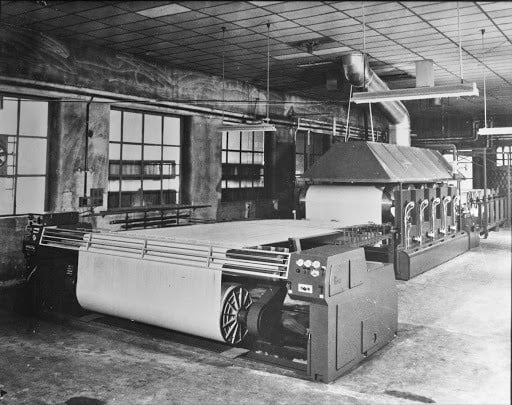
You are a GUI agent. You are given a task and a screenshot of the screen. Output one action in this format:
    pyautogui.click(x=<x>, y=<y>)
    Task: Click on the fan
    Image resolution: width=512 pixels, height=405 pixels.
    Given the screenshot: What is the action you would take?
    pyautogui.click(x=1, y=162)